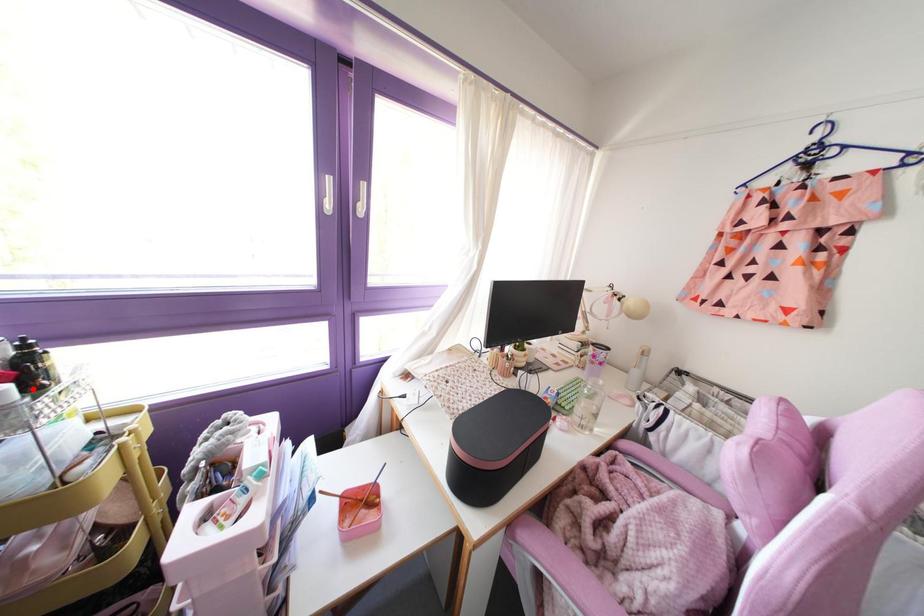
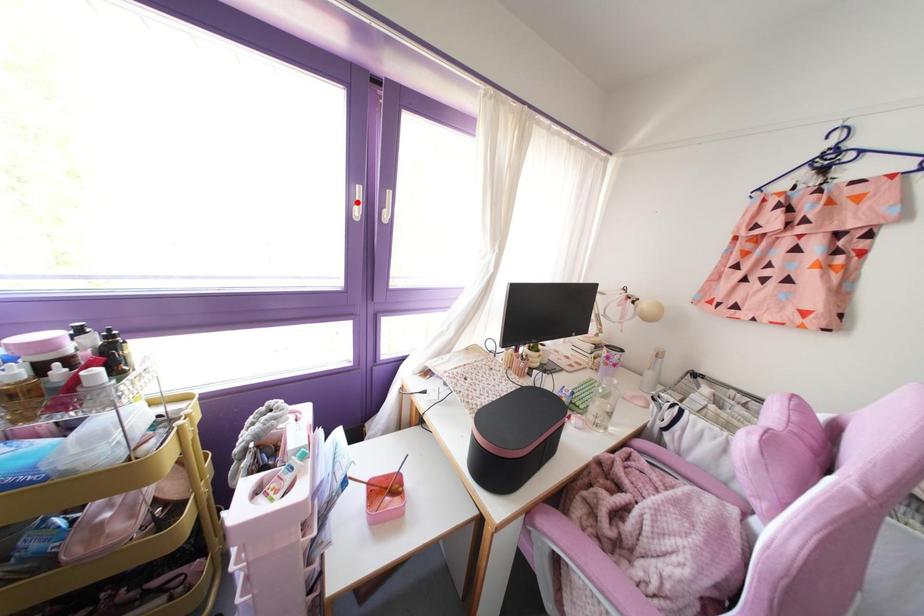
I am providing you with two images of the same scene from different viewpoints. A red point is marked on the first image and another point is marked on the second image. Do the highlighted points in image1 and image2 indicate the same real-world spot?

No